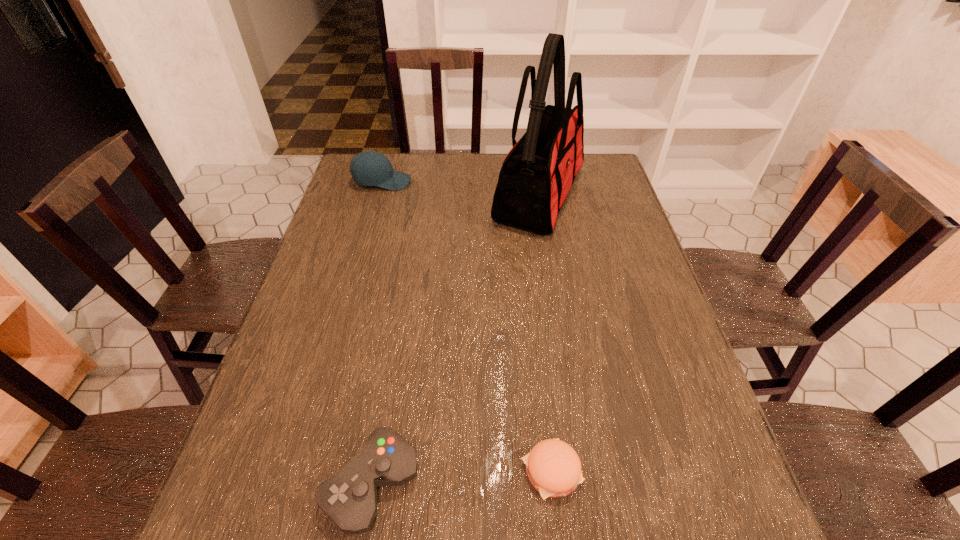
I want to click on the tallest object, so (x=537, y=173).

At what (x,y) coordinates should I click in order to perform the action: click on baseball cap. Please return your answer as a coordinate pair (x, y). Looking at the image, I should click on [x=369, y=168].

You are a GUI agent. You are given a task and a screenshot of the screen. Output one action in this format:
    pyautogui.click(x=<x>, y=<y>)
    Task: Click on the third tallest object
    The image size is (960, 540).
    Given the screenshot: What is the action you would take?
    pyautogui.click(x=349, y=498)

I want to click on patty, so click(x=554, y=469).

Where is `free space located on the right of the duffel bag`? free space located on the right of the duffel bag is located at coordinates (613, 196).

Locate an element on the screen. This screenshot has width=960, height=540. vacant point located on the front-facing side of the second tallest object is located at coordinates (519, 182).

The height and width of the screenshot is (540, 960). In order to click on vacant region located on the back of the control in this screenshot , I will do `click(399, 316)`.

Image resolution: width=960 pixels, height=540 pixels. Find the location of `free region located on the left of the patty`. free region located on the left of the patty is located at coordinates [344, 471].

Where is `duffel bag at the far edge`? duffel bag at the far edge is located at coordinates (537, 173).

You are a GUI agent. You are given a task and a screenshot of the screen. Output one action in this format:
    pyautogui.click(x=<x>, y=<y>)
    Task: Click on the baseball cap that is at the far edge
    
    Given the screenshot: What is the action you would take?
    pyautogui.click(x=369, y=168)